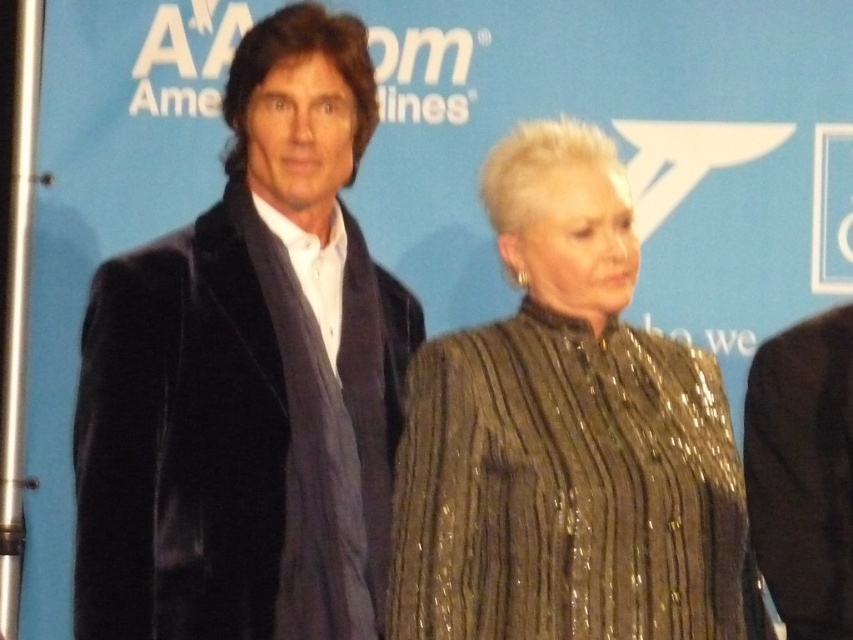
Question: Does velvet black coat at left appear on the left side of shiny sequined dress at center?

Choices:
 (A) yes
 (B) no

Answer: (A)

Question: Does velvet black coat at left appear under shiny sequined dress at center?

Choices:
 (A) yes
 (B) no

Answer: (B)

Question: Estimate the real-world distances between objects in this image. Which object is farther from the velvet black coat at left?

Choices:
 (A) black velvet suit at right
 (B) shiny sequined dress at center

Answer: (A)

Question: Where is velvet black coat at left located in relation to black velvet suit at right in the image?

Choices:
 (A) above
 (B) below

Answer: (A)

Question: Which of these objects is positioned farthest from the black velvet suit at right?

Choices:
 (A) velvet black coat at left
 (B) shiny sequined dress at center

Answer: (A)

Question: Which point appears closest to the camera in this image?

Choices:
 (A) (218, 408)
 (B) (451, 515)

Answer: (B)